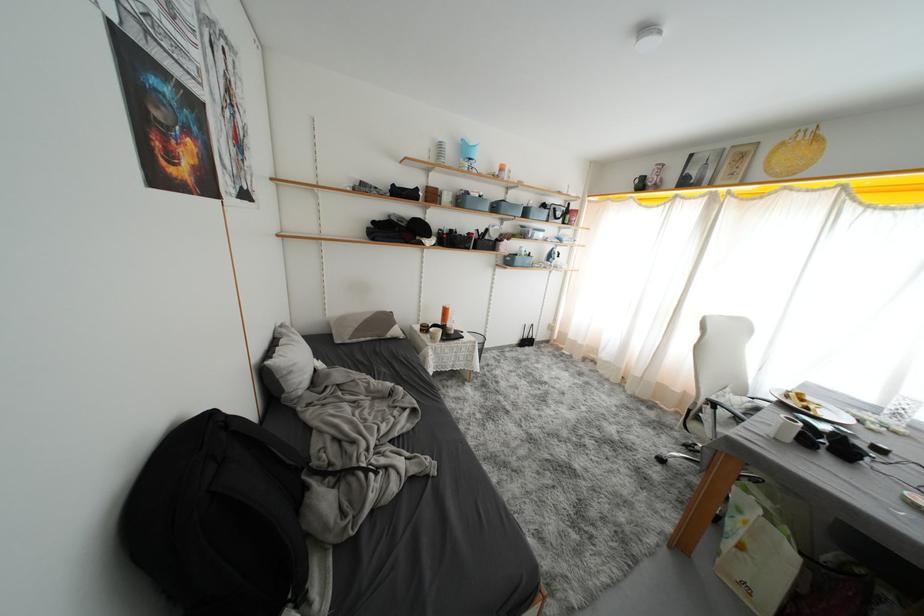
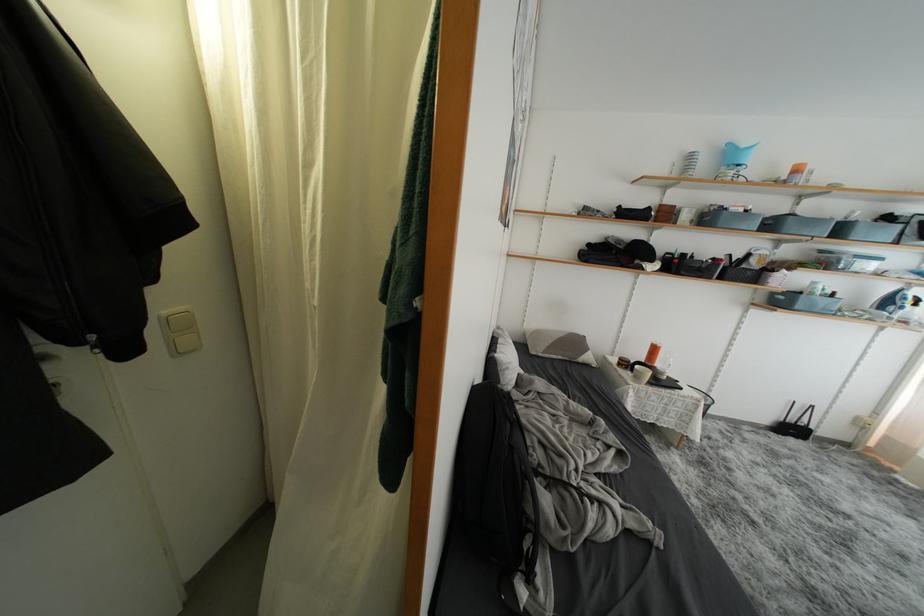
The point at (506, 265) is marked in the first image. Where is the corresponding point in the second image?

(767, 304)